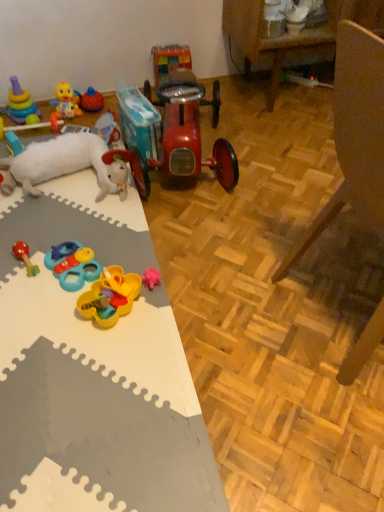
Locate an element on the screen. vacant area that lies between plastic/soft yellow and blue toy at lower left, the 4th toy viewed from the right, and rubberized red and green rattle at lower left, which ranks as the eighth toy in right-to-left order is located at coordinates (48, 277).